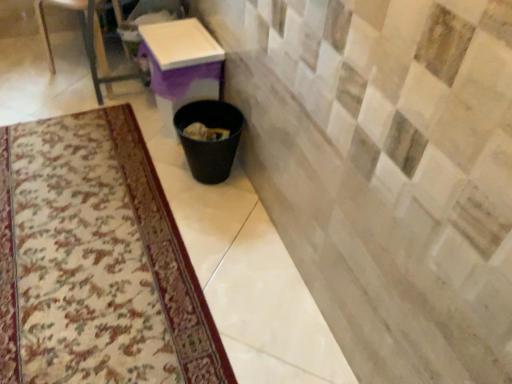
Find the location of `vacant space underneath black plastic trash can at lower center (from a real-world perspective)`. vacant space underneath black plastic trash can at lower center (from a real-world perspective) is located at coordinates (215, 178).